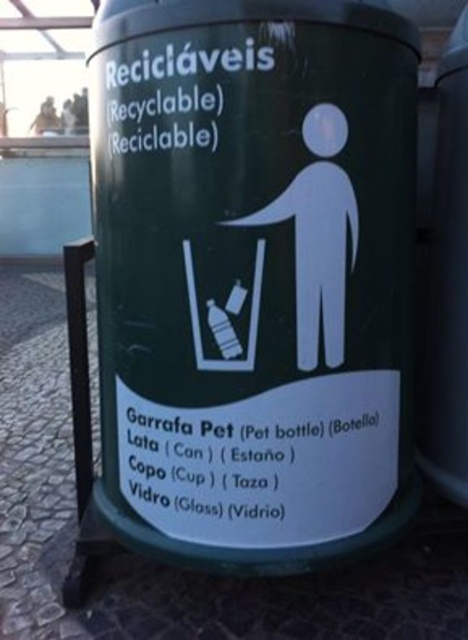
Based on the photo, you are standing in front of a recycling bin and want to place a plastic bottle. The recycling bin is represented by the point at coordinates (x=254, y=275). Where should you aim to place the plastic bottle?

The green matte recycling bin at center is represented by point (x=254, y=275). You should aim for that point to place the plastic bottle.